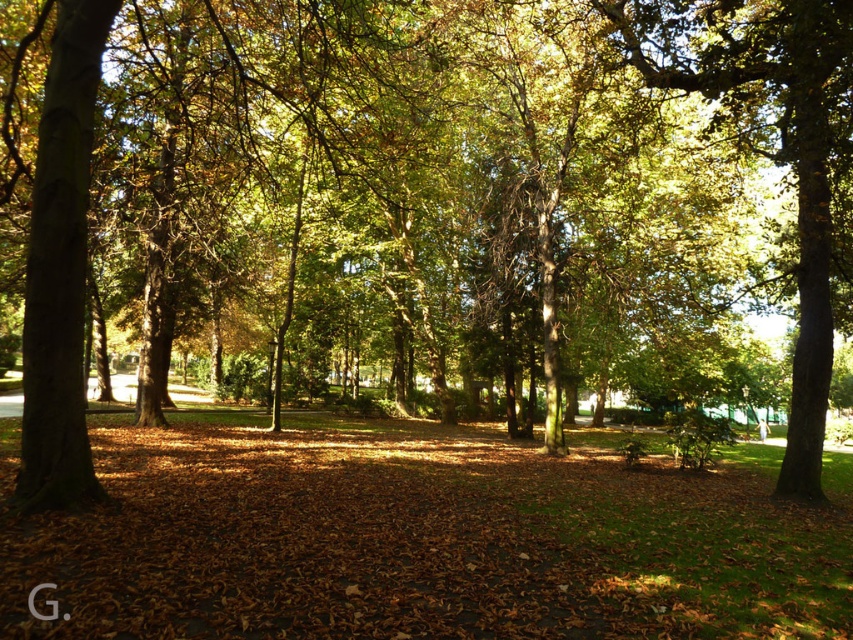
Describe the element at coordinates (422, 538) in the screenshot. I see `brown leaf litter at center` at that location.

Based on the photo, can you confirm if brown leaf litter at center is bigger than green leafy tree at center?

Indeed, brown leaf litter at center has a larger size compared to green leafy tree at center.

Who is more distant from viewer, (250, 481) or (660, 6)?

Point (660, 6)

You are a GUI agent. You are given a task and a screenshot of the screen. Output one action in this format:
    pyautogui.click(x=<x>, y=<y>)
    Task: Click on the brown leaf litter at center
    The height and width of the screenshot is (640, 853).
    Given the screenshot: What is the action you would take?
    pyautogui.click(x=422, y=538)